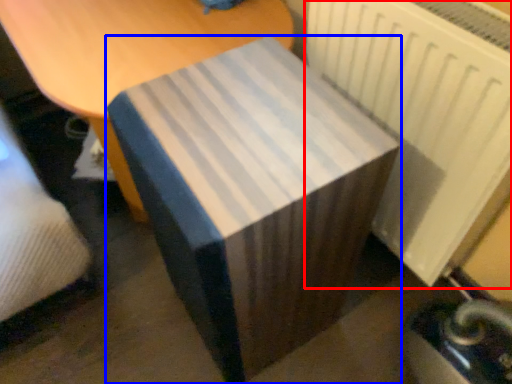
Question: Which object appears closest to the camera in this image, radiator (highlighted by a red box) or table (highlighted by a blue box)?

Choices:
 (A) radiator
 (B) table

Answer: (B)